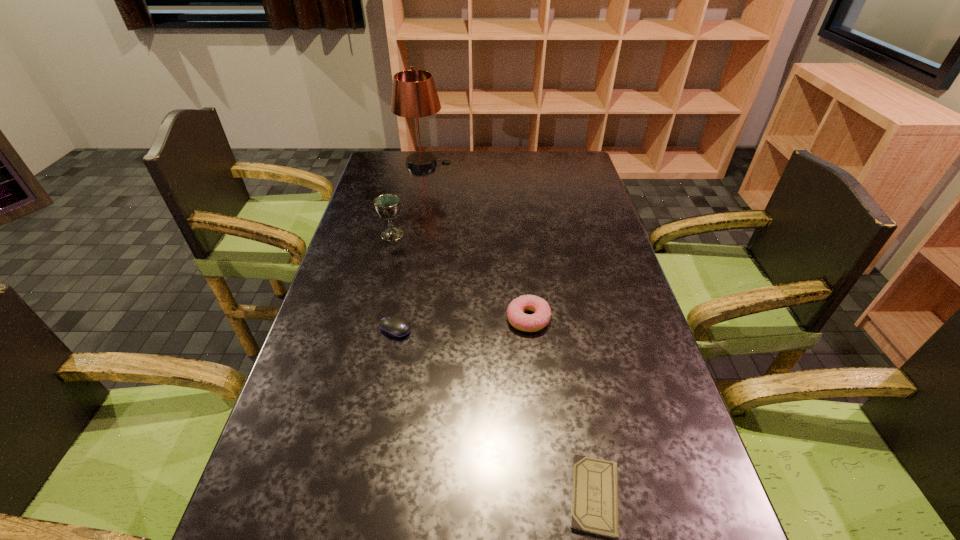
Identify the location of free space at the right edge of the desktop. (627, 471).

Identify the location of vacant area that lies between the computer mouse and the shortest object. coord(494,412).

Find the location of `vacant area that lies between the fourth shortest object and the doughnut`. vacant area that lies between the fourth shortest object and the doughnut is located at coordinates (460, 277).

You are a GUI agent. You are given a task and a screenshot of the screen. Output one action in this format:
    pyautogui.click(x=<x>, y=<y>)
    Task: Click on the vacant space that is in between the computer mouse and the checkbook
    Image resolution: width=960 pixels, height=540 pixels.
    Given the screenshot: What is the action you would take?
    pyautogui.click(x=494, y=412)

Where is `empty location between the third shortest object and the lampshade`? This screenshot has width=960, height=540. empty location between the third shortest object and the lampshade is located at coordinates (476, 241).

This screenshot has width=960, height=540. I want to click on vacant point located between the chalice and the nearest object, so click(x=493, y=365).

You are a GUI agent. You are given a task and a screenshot of the screen. Output one action in this format:
    pyautogui.click(x=<x>, y=<y>)
    Task: Click on the free space between the chalice and the nearest object
    This screenshot has height=540, width=960.
    Given the screenshot: What is the action you would take?
    pyautogui.click(x=493, y=365)

Where is `free space that is in between the fourth tallest object and the lampshade`? This screenshot has height=540, width=960. free space that is in between the fourth tallest object and the lampshade is located at coordinates pyautogui.click(x=409, y=246).

Image resolution: width=960 pixels, height=540 pixels. In order to click on empty space between the farthest object and the checkbook in this screenshot , I will do `click(509, 330)`.

At what (x,y) coordinates should I click in order to perform the action: click on free spot between the computer mouse and the fourth shortest object. Please return your answer as a coordinate pair (x, y). Looking at the image, I should click on (394, 282).